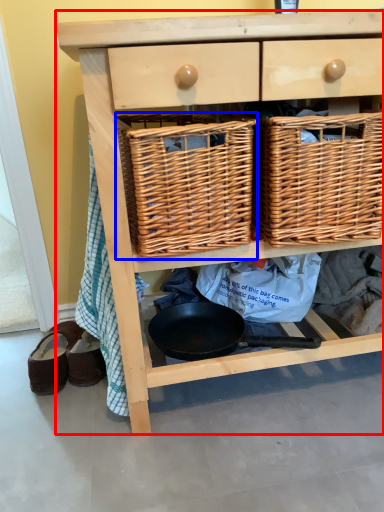
Question: Which object appears closest to the camera in this image, chest of drawers (highlighted by a red box) or picnic basket (highlighted by a blue box)?

Choices:
 (A) chest of drawers
 (B) picnic basket

Answer: (A)